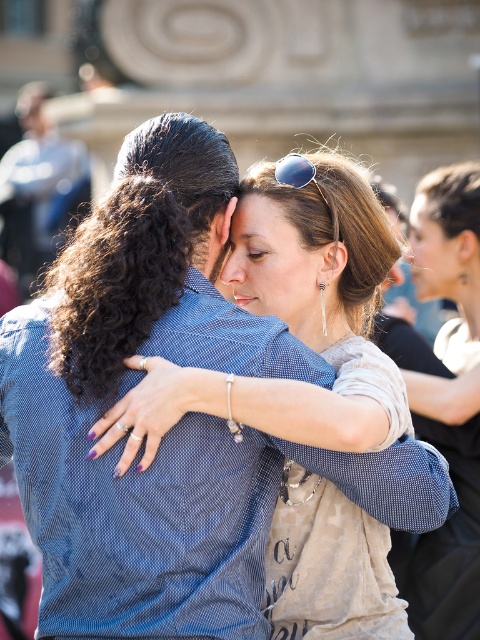
Does matte blue shirt at center appear on the left side of sunglasses at center?

In fact, matte blue shirt at center is to the right of sunglasses at center.

Does matte blue shirt at center come in front of sunglasses at center?

Yes, matte blue shirt at center is closer to the viewer.

Where is `matte blue shirt at center`? Image resolution: width=480 pixels, height=640 pixels. matte blue shirt at center is located at coordinates (299, 316).

Is matte blue shirt at center closer to camera compared to light beige fabric purse at center?

Yes.

Which is more to the left, matte blue shirt at center or light beige fabric purse at center?

Positioned to the left is matte blue shirt at center.

Find the location of a particular element. The width and height of the screenshot is (480, 640). matte blue shirt at center is located at coordinates (299, 316).

Can you confirm if light beige fabric purse at center is taller than sunglasses at center?

Indeed, light beige fabric purse at center has a greater height compared to sunglasses at center.

Which is above, light beige fabric purse at center or sunglasses at center?

sunglasses at center is higher up.

Where is `light beige fabric purse at center`? The height and width of the screenshot is (640, 480). light beige fabric purse at center is located at coordinates (444, 403).